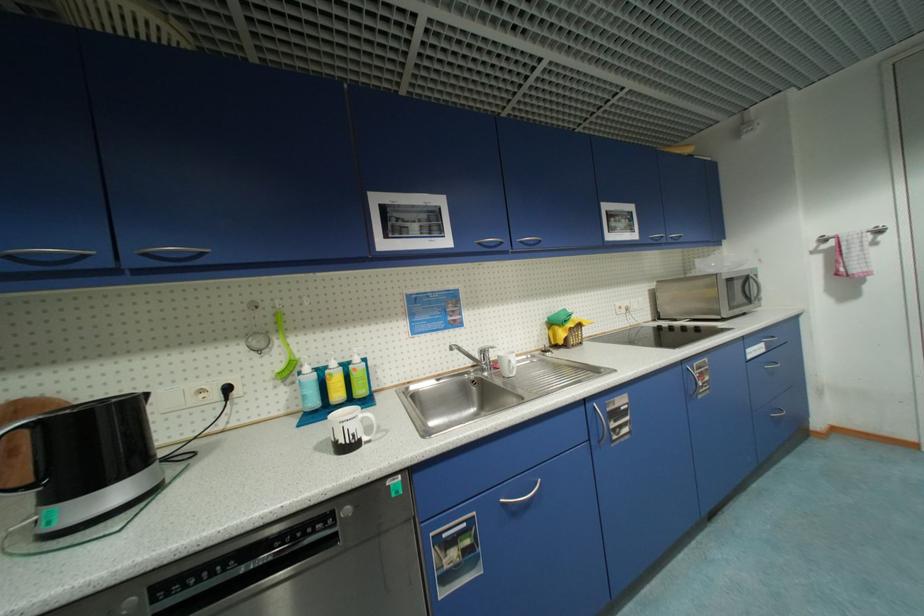
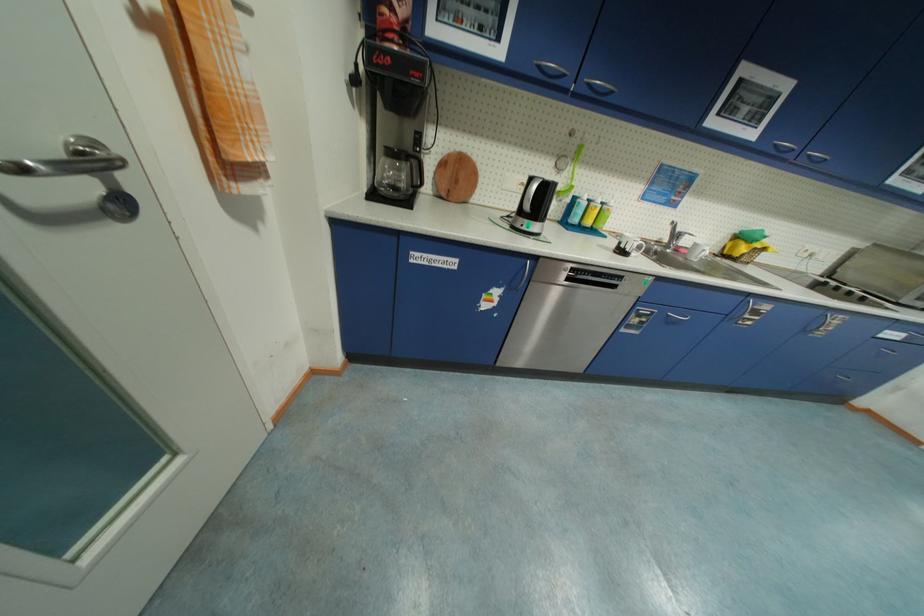
Where in the second image is the point corresponding to [208,392] from the first image?

(529, 185)